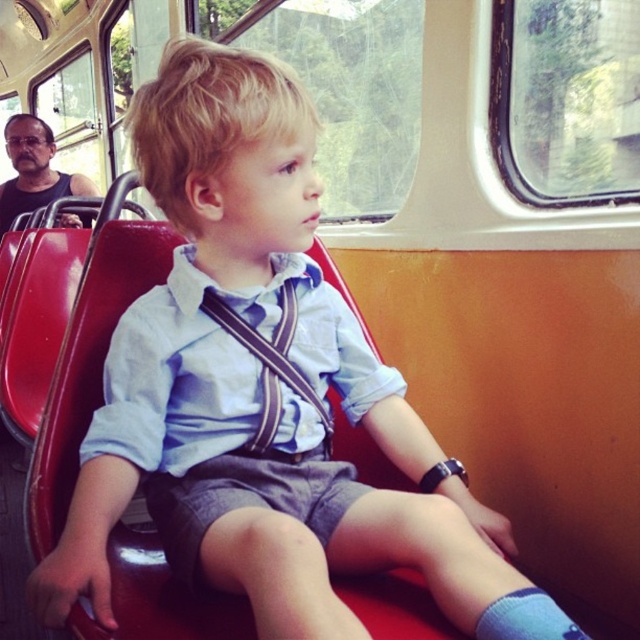
The child is wearing two items of clothing. Which item is positioned lower on the body between the striped fabric suspenders at center and the black tank top at left?

The striped fabric suspenders at center are positioned lower than the black tank top at left.

You are a designer creating a 3D model of the child in the image. To accurately place the striped fabric suspenders at center, what coordinates should you use?

The striped fabric suspenders at center should be placed at coordinates point (269, 364).